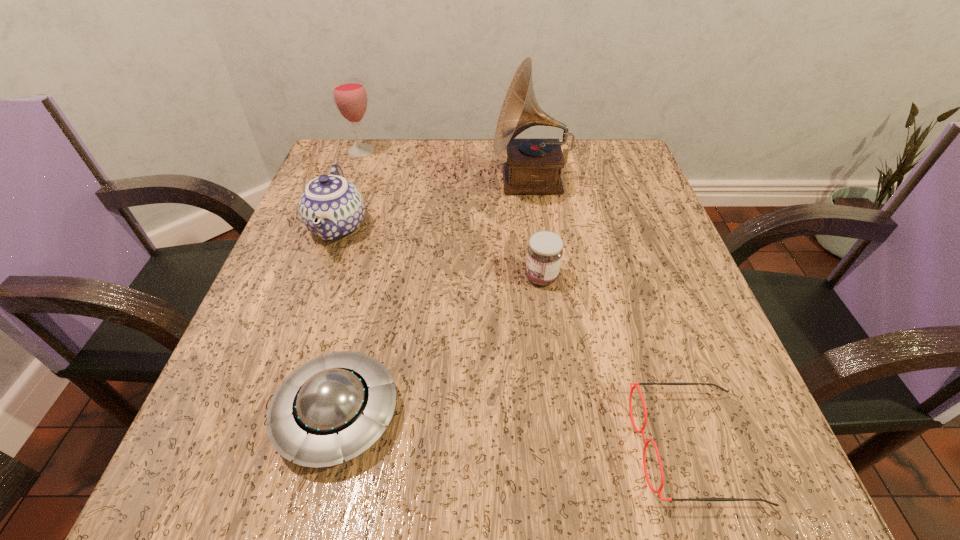
This screenshot has width=960, height=540. In order to click on the tallest object in this screenshot , I will do `click(533, 166)`.

The width and height of the screenshot is (960, 540). I want to click on the second tallest object, so tap(350, 97).

Image resolution: width=960 pixels, height=540 pixels. What are the coordinates of `the third tallest object` in the screenshot? It's located at (331, 207).

The width and height of the screenshot is (960, 540). I want to click on jam, so click(544, 253).

The height and width of the screenshot is (540, 960). Identify the location of saucer. (334, 407).

Locate an element on the screen. the shortest object is located at coordinates (646, 445).

Image resolution: width=960 pixels, height=540 pixels. I want to click on spectacles, so click(646, 445).

In order to click on vacant space positioned on the horn of the phonograph record in this screenshot , I will do `click(399, 181)`.

Image resolution: width=960 pixels, height=540 pixels. In order to click on vacant space located 0.380m on the horn of the phonograph record in this screenshot , I will do `click(324, 181)`.

The image size is (960, 540). I want to click on free space located on the horn of the phonograph record, so click(x=435, y=181).